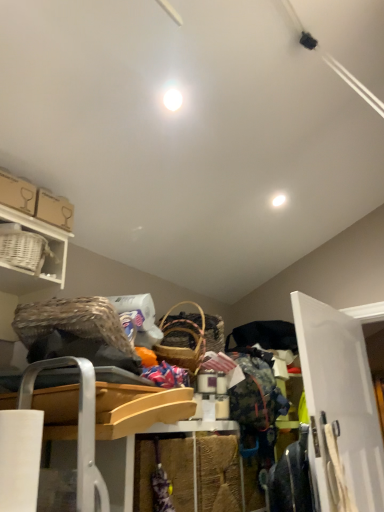
Question: From a real-world perspective, is white wood door at right physically located above or below floral fabric dress at lower right?

Choices:
 (A) below
 (B) above

Answer: (B)

Question: In terms of width, does white wood door at right look wider or thinner when compared to floral fabric dress at lower right?

Choices:
 (A) thin
 (B) wide

Answer: (A)

Question: Which is farther from the white glossy light fixture at upper center, the 2th light in the front-to-back sequence?

Choices:
 (A) white glossy light bulb at center, positioned as the 1th light in top-to-bottom order
 (B) white wood door at right
 (C) floral fabric dress at lower right
 (D) white wicker basket at upper left

Answer: (C)

Question: Which object is positioned farthest from the white wicker basket at upper left?

Choices:
 (A) floral fabric dress at lower right
 (B) white wood door at right
 (C) white glossy light bulb at center, marked as the second light in a back-to-front arrangement
 (D) white glossy light fixture at upper center, the 1th light positioned from the back

Answer: (B)